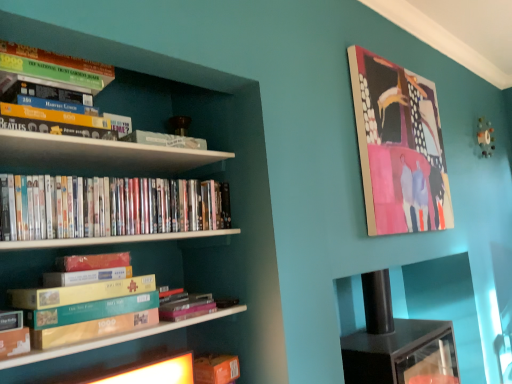
Question: Considering their positions, is teal cardboard box at lower left, which ranks as the 3th book in top-to-bottom order, located in front of or behind white glossy bookshelf at left?

Choices:
 (A) behind
 (B) front

Answer: (A)

Question: In terms of width, does teal cardboard box at lower left, which ranks as the 3th book in top-to-bottom order, look wider or thinner when compared to white glossy bookshelf at left?

Choices:
 (A) wide
 (B) thin

Answer: (B)

Question: Which of these objects is positioned closest to the white glossy bookshelf at left?

Choices:
 (A) black glossy cabinet at lower right
 (B) teal cardboard box at lower left, which ranks as the 3th book in top-to-bottom order
 (C) green cardboard book at upper left, which appears as the first book when viewed from the top
 (D) hardcover book at center, arranged as the second book when ordered from the bottom
 (E) matte plastic dvds at left, acting as the fourth book starting from the bottom

Answer: (E)

Question: Based on their relative distances, which object is farther from the teal cardboard box at lower left, which ranks as the 3th book in top-to-bottom order?

Choices:
 (A) matte plastic dvds at left, the 2th book viewed from the top
 (B) orange cardboard box at lower left, positioned as the 5th book in top-to-bottom order
 (C) matte wooden picture frame at upper right
 (D) white glossy bookshelf at left
 (E) hardcover book at center, arranged as the second book when ordered from the bottom

Answer: (C)